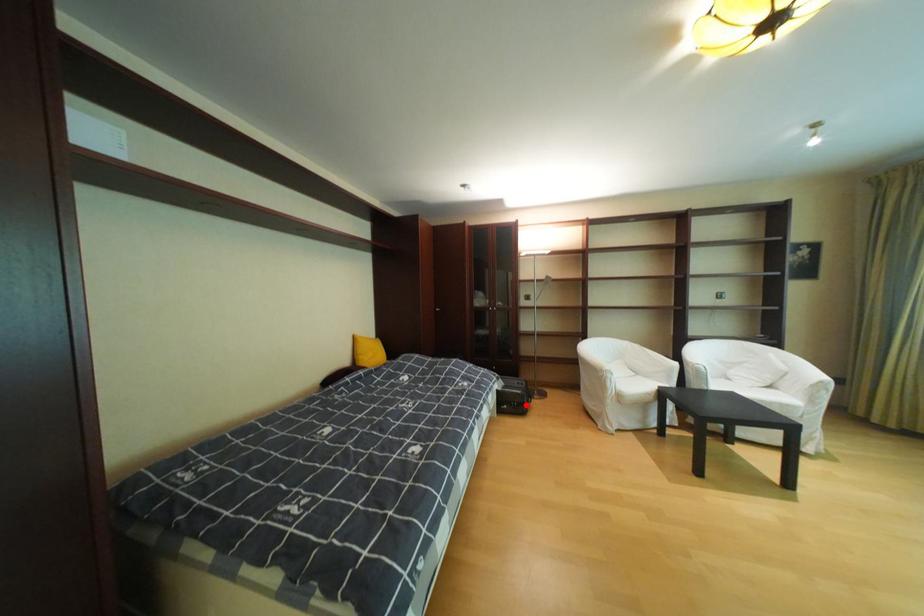
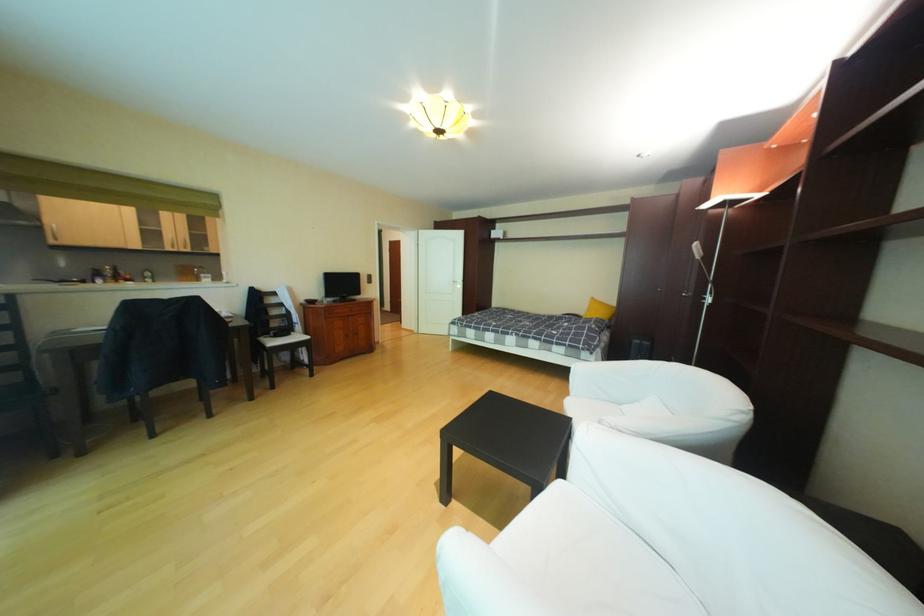
Question: I am providing you with two images of the same scene from different viewpoints. A red point is marked on the first image. Is the red point's position out of view in image 2?

Choices:
 (A) Yes
 (B) No

Answer: (A)